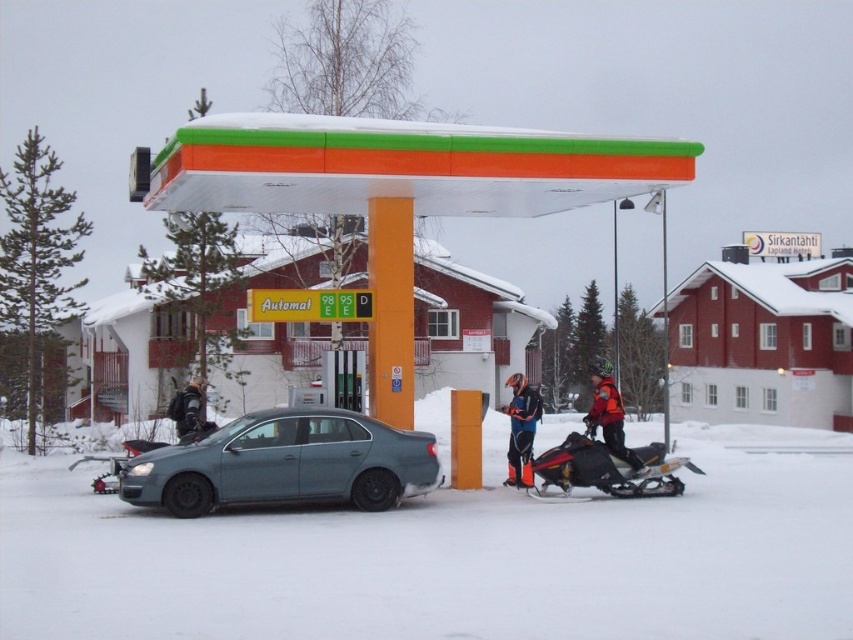
You are a delivery driver who needs to park your truck next to the white powdery snow at center and the orange matte gas station canopy at center. Based on their heights, which object should you avoid parking too close to and why?

You should avoid parking too close to the orange matte gas station canopy at center because it is taller than the white powdery snow at center.